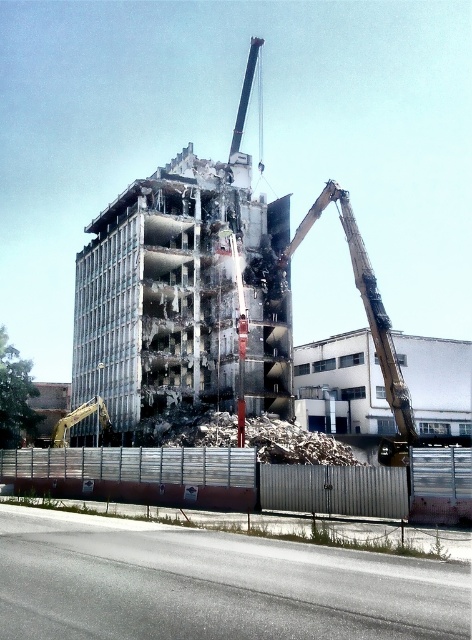
You are standing at the demolition site and want to determine the safest path to avoid falling debris. You notice two points marked in the image. Which point is closer to you, point (219, 342) or point (305, 218)?

Point (219, 342) is closer to you because it is further to the viewer than point (305, 218).